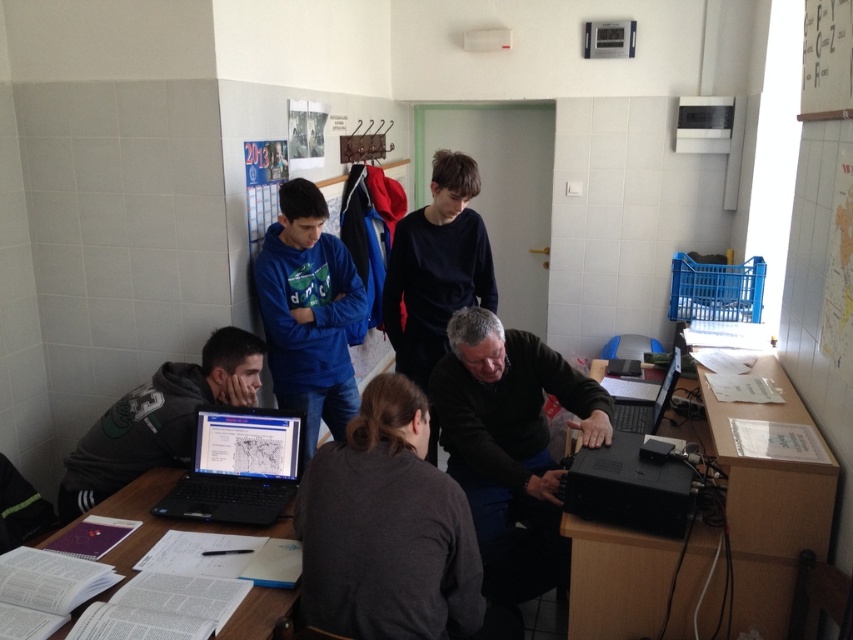
Question: Does black plastic table at right appear under black glossy laptop at lower center?

Choices:
 (A) yes
 (B) no

Answer: (A)

Question: Is dark gray sweater at lower center smaller than black matte shirt at center?

Choices:
 (A) yes
 (B) no

Answer: (A)

Question: Which of the following is the closest to the observer?

Choices:
 (A) black matte laptop at lower center
 (B) black plastic computer at lower right
 (C) matte black computer at center
 (D) black glossy laptop at lower center

Answer: (B)

Question: Does dark gray sweater at lower center have a lesser width compared to black matte laptop at lower center?

Choices:
 (A) no
 (B) yes

Answer: (A)

Question: Based on their relative distances, which object is nearer to the black matte laptop at lower center?

Choices:
 (A) blue fleece jacket at center
 (B) white paper at lower left
 (C) gray hoodie at lower left
 (D) matte black computer at center

Answer: (B)

Question: Based on their relative distances, which object is farther from the black matte shirt at center?

Choices:
 (A) black plastic computer at lower right
 (B) black plastic table at right

Answer: (B)